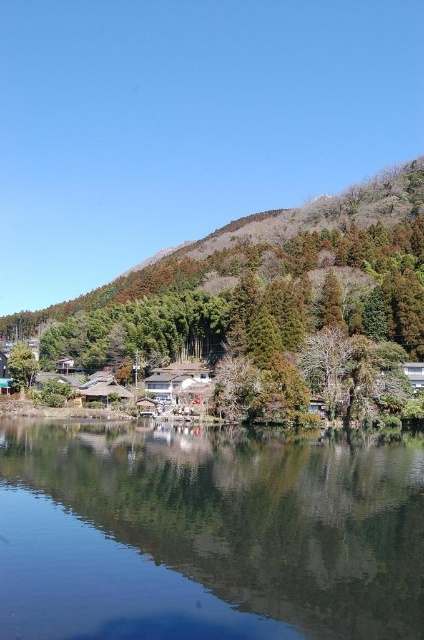
You are standing at the edge of the transparent glass water at lower center and want to look up towards the green leafy hillside at upper center. In which direction should you look?

You should look upwards because the transparent glass water at lower center is located below the green leafy hillside at upper center.

You are standing in the serene landscape and want to take a photo of both the transparent glass water at lower center and the green leafy hillside at upper center. Which object should you position to the left side of your camera frame to include both in the shot?

You should position the transparent glass water at lower center to the left side of your camera frame because it is already to the left of the green leafy hillside at upper center.